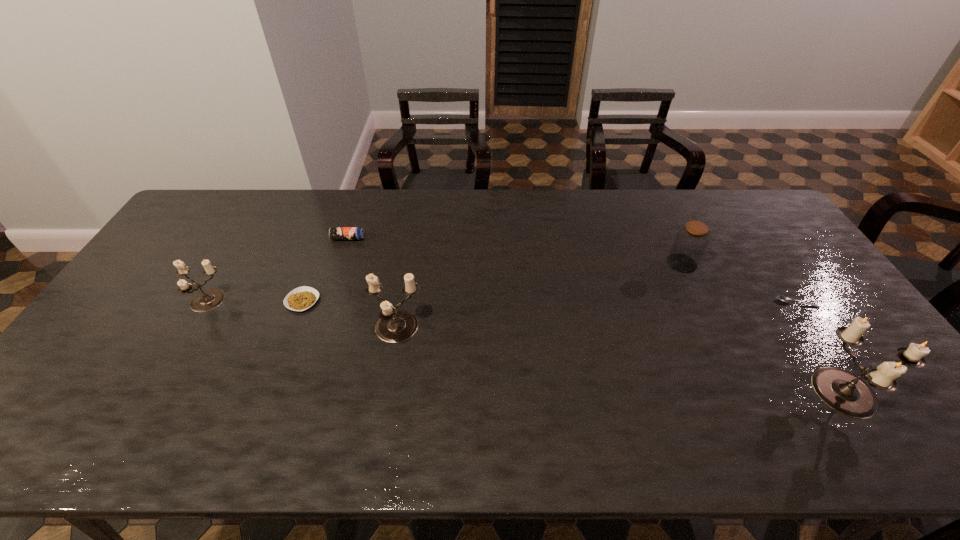
You are a GUI agent. You are given a task and a screenshot of the screen. Output one action in this format:
    pyautogui.click(x=<x>, y=<y>)
    Task: Click on the free space between the nearest candle holder and the soupspoon
    Image resolution: width=960 pixels, height=540 pixels.
    Given the screenshot: What is the action you would take?
    pyautogui.click(x=823, y=347)

You are a GUI agent. You are given a task and a screenshot of the screen. Output one action in this format:
    pyautogui.click(x=<x>, y=<y>)
    Task: Click on the blank region between the tallest object and the soupspoon
    This screenshot has width=960, height=540.
    Given the screenshot: What is the action you would take?
    pyautogui.click(x=823, y=347)

Locate an element on the screen. The width and height of the screenshot is (960, 540). free spot between the second tallest candle holder and the soupspoon is located at coordinates (596, 316).

You are a GUI agent. You are given a task and a screenshot of the screen. Output one action in this format:
    pyautogui.click(x=<x>, y=<y>)
    Task: Click on the free spot between the soupspoon and the jar
    The width and height of the screenshot is (960, 540).
    Given the screenshot: What is the action you would take?
    pyautogui.click(x=739, y=283)

Identify which object is the second closest to the shortest object. Please provide its 2D coordinates. Your answer should be formatted as a tuple, i.e. [(x, y)], where the tuple contains the x and y coordinates of a point satisfying the conditions above.

[(690, 243)]

Locate an element on the screen. object that is the sixth closest to the jar is located at coordinates (209, 299).

The image size is (960, 540). I want to click on candle holder that can be found as the closest to the legume, so click(x=394, y=326).

Locate an element on the screen. The image size is (960, 540). candle holder that is the third nearest to the second shortest object is located at coordinates (844, 392).

You are a GUI agent. You are given a task and a screenshot of the screen. Output one action in this format:
    pyautogui.click(x=<x>, y=<y>)
    Task: Click on the vacant region that satisfies the following two spatial constraints: 1. on the front side of the nearest object; 2. on the right side of the second candle holder from left to right
    The height and width of the screenshot is (540, 960).
    Given the screenshot: What is the action you would take?
    pyautogui.click(x=386, y=392)

Locate an element on the screen. vacant space that satisfies the following two spatial constraints: 1. on the back side of the sixth nearest object; 2. on the right side of the shortest candle holder is located at coordinates (229, 263).